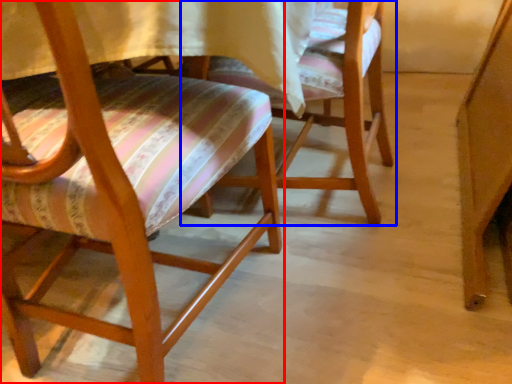
Question: Which point is further to the camera, chair (highlighted by a red box) or chair (highlighted by a blue box)?

Choices:
 (A) chair
 (B) chair

Answer: (B)